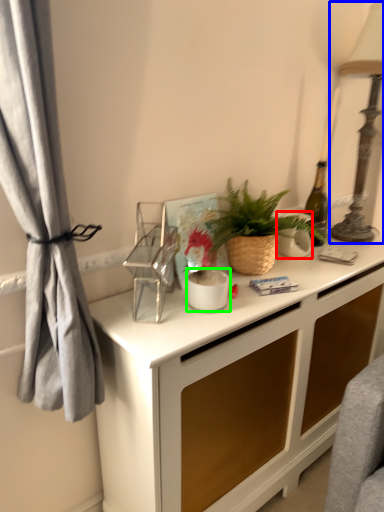
Question: Which object is positioned farthest from appliance (highlighted by a red box)? Select from table lamp (highlighted by a blue box) and appliance (highlighted by a green box).

Choices:
 (A) table lamp
 (B) appliance

Answer: (B)